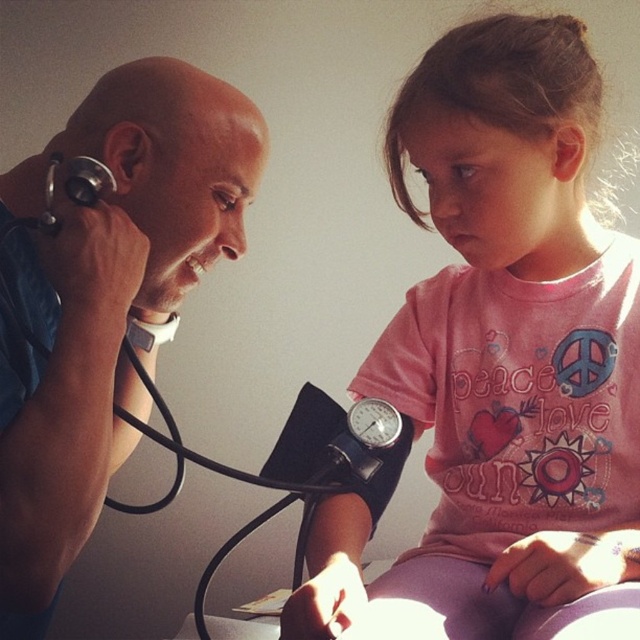
Question: Which point appears closest to the camera in this image?

Choices:
 (A) (460, 147)
 (B) (218, 140)

Answer: (B)

Question: Can you confirm if pink fabric shirt at upper right is wider than blue fabric stethoscope at left?

Choices:
 (A) yes
 (B) no

Answer: (A)

Question: Which of the following is the farthest from the observer?

Choices:
 (A) (492, 348)
 (B) (125, 237)

Answer: (A)

Question: Observing the image, what is the correct spatial positioning of pink fabric shirt at upper right in reference to blue fabric stethoscope at left?

Choices:
 (A) above
 (B) below

Answer: (A)

Question: Does pink fabric shirt at upper right have a smaller size compared to blue fabric stethoscope at left?

Choices:
 (A) yes
 (B) no

Answer: (B)

Question: Which object is closer to the camera taking this photo?

Choices:
 (A) pink fabric shirt at upper right
 (B) blue fabric stethoscope at left

Answer: (B)